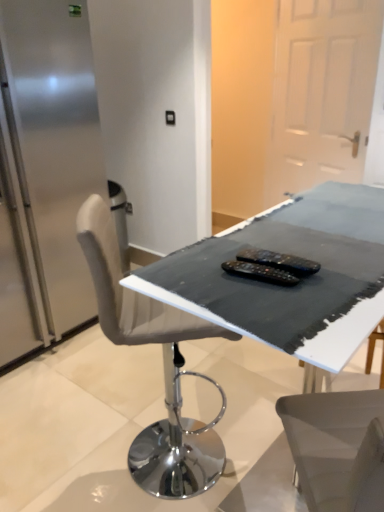
Where is `free space to the back side of black plastic remote controls at center, the 1th equipment viewed from the top`? The image size is (384, 512). free space to the back side of black plastic remote controls at center, the 1th equipment viewed from the top is located at coordinates (272, 239).